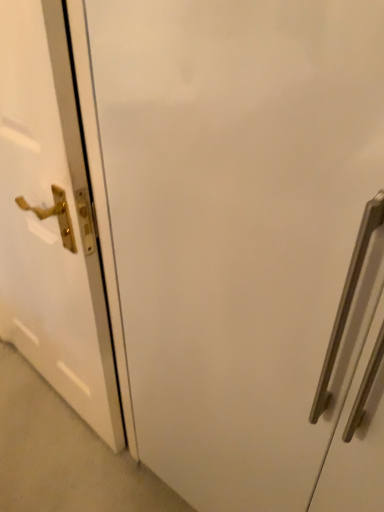
This screenshot has width=384, height=512. What do you see at coordinates (51, 221) in the screenshot? I see `white glossy door at left` at bounding box center [51, 221].

At what (x,y) coordinates should I click in order to perform the action: click on white glossy door at left. Please return your answer as a coordinate pair (x, y). This screenshot has height=512, width=384. Looking at the image, I should click on (51, 221).

At what (x,y) coordinates should I click in order to perform the action: click on white glossy door at left. Please return your answer as a coordinate pair (x, y). Image resolution: width=384 pixels, height=512 pixels. Looking at the image, I should click on (51, 221).